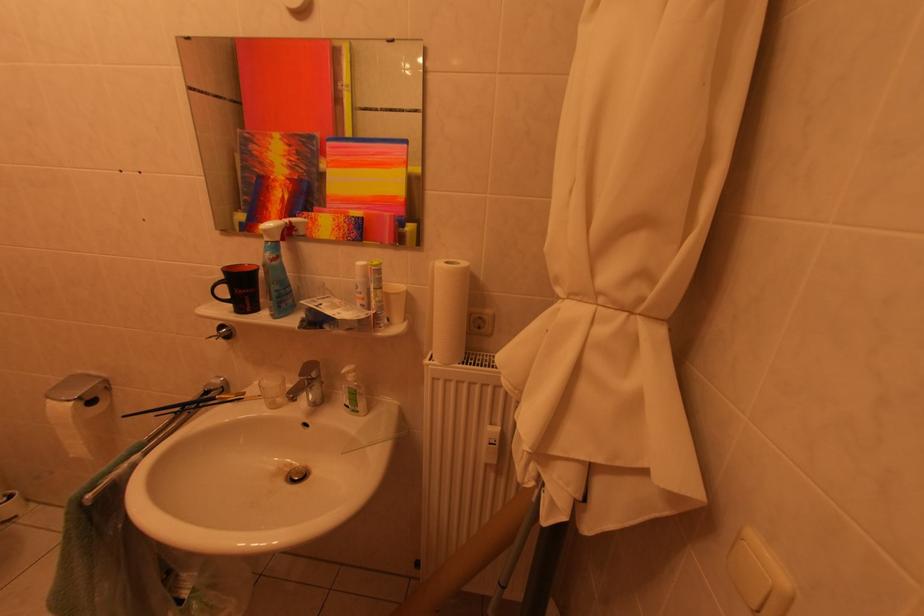
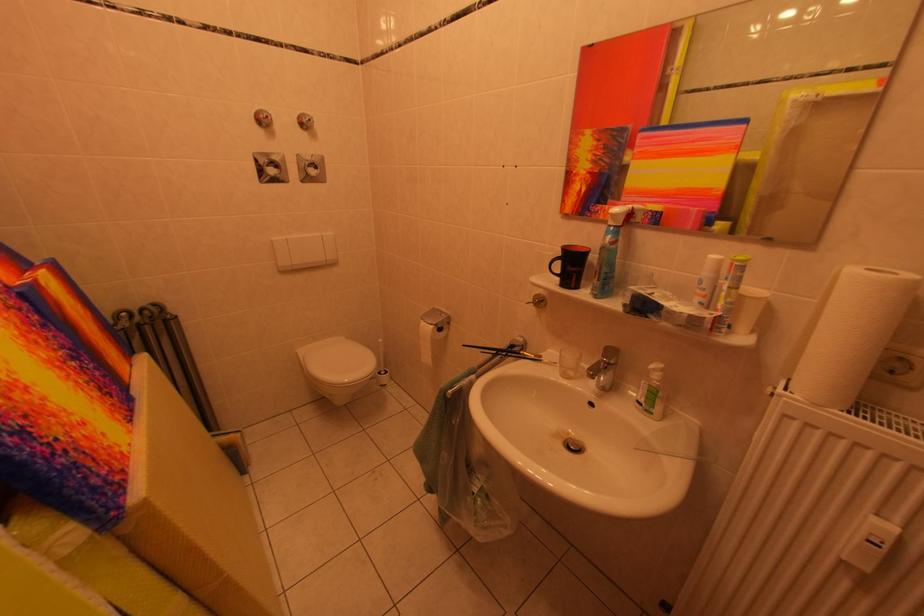
Locate, in the second image, the point that corresponds to the point at 215,397 in the first image.

(520, 351)